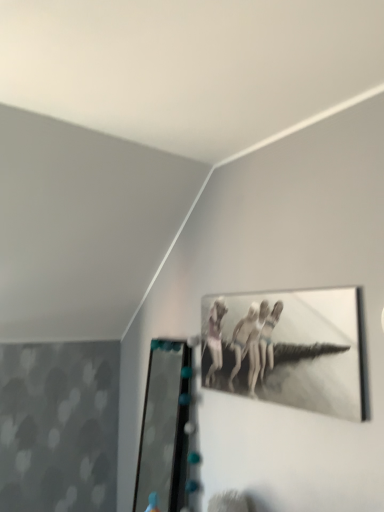
Locate an element on the screen. The width and height of the screenshot is (384, 512). clear glass mirror at center is located at coordinates (164, 426).

What do you see at coordinates (164, 426) in the screenshot? This screenshot has width=384, height=512. I see `clear glass mirror at center` at bounding box center [164, 426].

Locate an element on the screen. Image resolution: width=384 pixels, height=512 pixels. clear glass mirror at center is located at coordinates (164, 426).